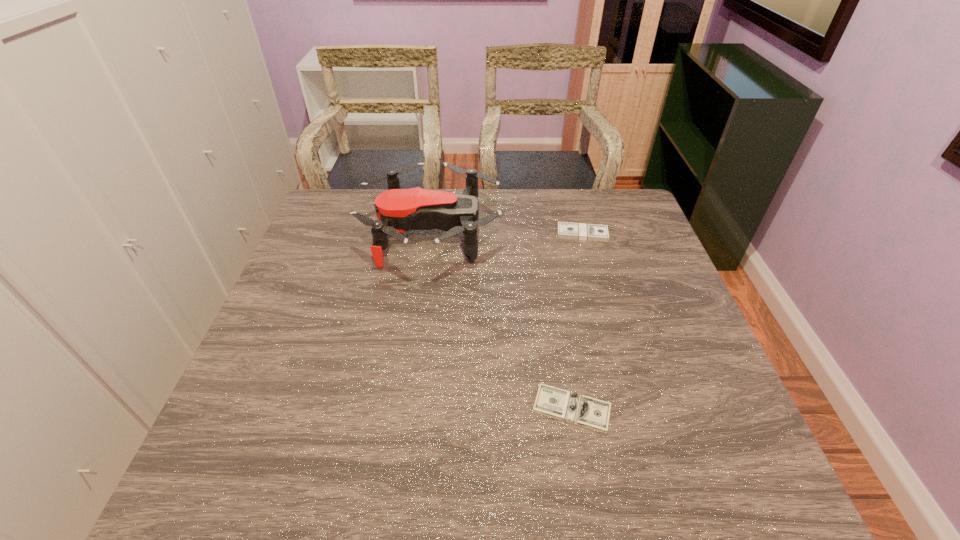
This screenshot has width=960, height=540. I want to click on the leftmost object, so click(x=398, y=210).

What are the coordinates of `the tallest object` in the screenshot? It's located at (398, 210).

You are a GUI agent. You are given a task and a screenshot of the screen. Output one action in this format:
    pyautogui.click(x=<x>, y=<y>)
    Task: Click on the second shortest object
    
    Given the screenshot: What is the action you would take?
    pyautogui.click(x=565, y=230)

Identify the location of the taller dollar. (565, 230).

Identify the location of the nearest object. (588, 412).

In order to click on the shorter dollar in this screenshot , I will do `click(588, 412)`.

The image size is (960, 540). What are the coordinates of `free point located on the camera side of the tallest object` in the screenshot? It's located at (554, 231).

Locate an element on the screen. Image resolution: width=960 pixels, height=540 pixels. free location located on the front of the taller dollar is located at coordinates (611, 336).

The image size is (960, 540). What are the coordinates of `vacant space located 0.080m on the back of the nearer dollar` in the screenshot? It's located at (563, 356).

This screenshot has height=540, width=960. In order to click on drone that is positioned at the far edge in this screenshot , I will do `click(398, 210)`.